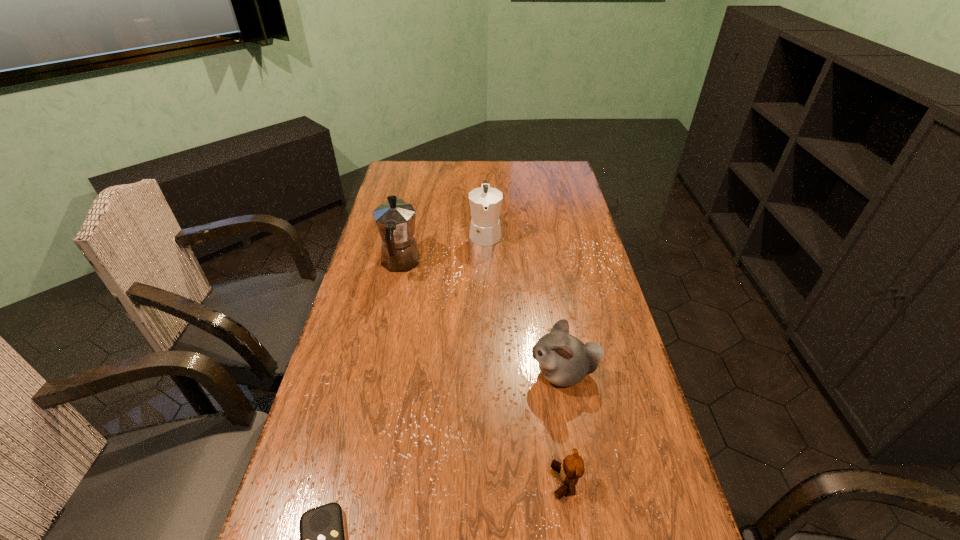
Find the location of a particular element. Image resolution: width=960 pixels, height=540 pixels. free space located 0.050m on the pouring side of the left coffeepot is located at coordinates (406, 235).

Identify the location of vacant region located 0.110m at the spout of the second tallest object. (486, 271).

Where is `vacant space situated 0.290m on the face of the third tallest object`? vacant space situated 0.290m on the face of the third tallest object is located at coordinates (420, 374).

The width and height of the screenshot is (960, 540). What are the coordinates of `vacant area situated on the face of the third tallest object` in the screenshot? It's located at (476, 374).

The image size is (960, 540). What are the coordinates of `vacant position located 0.250m on the face of the third tallest object` in the screenshot? It's located at (435, 374).

This screenshot has width=960, height=540. I want to click on vacant space located 0.130m on the front-facing side of the fourth tallest object, so click(492, 481).

Find the location of a particular element. The image size is (960, 540). free region located on the front-facing side of the fourth tallest object is located at coordinates (510, 481).

Where is `free region located 0.350m on the front-facing side of the fourth tallest object`? This screenshot has height=540, width=960. free region located 0.350m on the front-facing side of the fourth tallest object is located at coordinates (389, 481).

Find the location of a particular element. This screenshot has width=960, height=540. object situated at the left edge is located at coordinates (395, 220).

Locate an element on the screen. The image size is (960, 540). object present at the right edge is located at coordinates (564, 360).